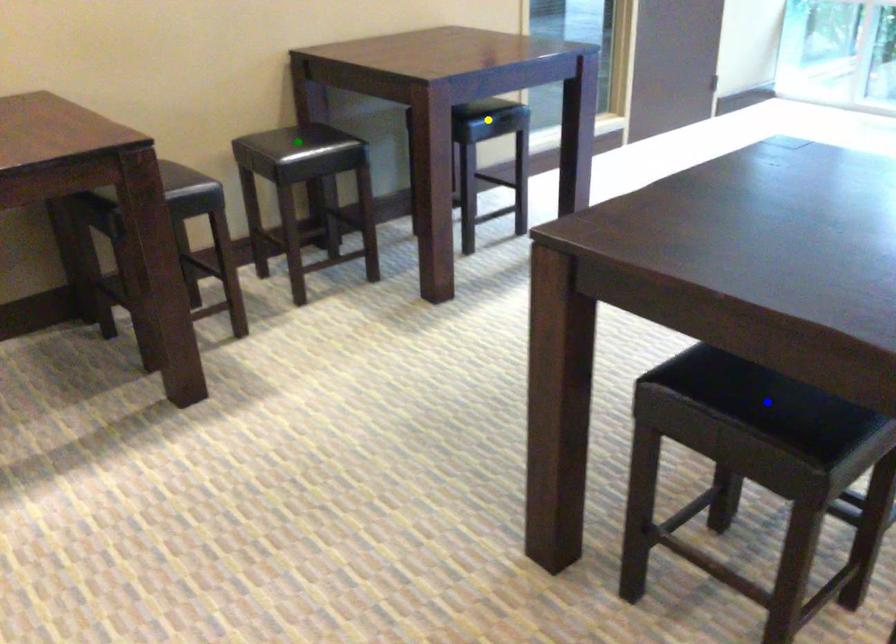
Order these from nearest to farthest:
blue point | yellow point | green point

blue point
yellow point
green point